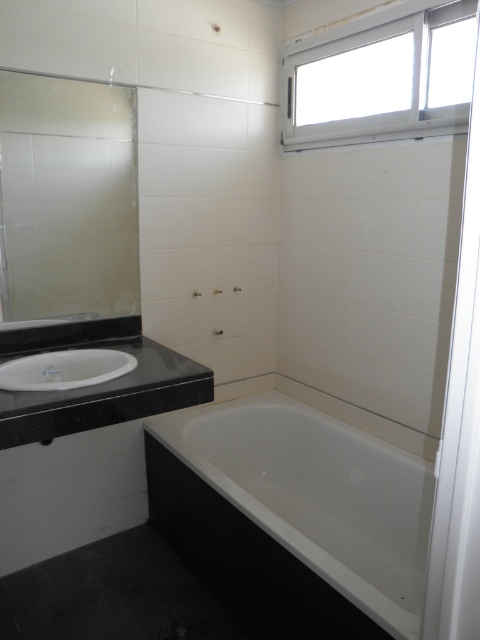
Question: Is the position of white glossy bathtub at lower center less distant than that of white plastic window at upper right?

Choices:
 (A) yes
 (B) no

Answer: (A)

Question: Estimate the real-world distances between objects in this image. Which object is farther from the white glossy bathtub at lower center?

Choices:
 (A) matte glass mirror at left
 (B) white plastic window at upper right
 (C) white glossy sink at lower left

Answer: (B)

Question: Based on their relative distances, which object is nearer to the white glossy sink at lower left?

Choices:
 (A) matte glass mirror at left
 (B) white glossy bathtub at lower center

Answer: (A)

Question: Can you confirm if white plastic window at upper right is smaller than white glossy sink at lower left?

Choices:
 (A) yes
 (B) no

Answer: (B)

Question: Does white plastic window at upper right have a larger size compared to white glossy sink at lower left?

Choices:
 (A) no
 (B) yes

Answer: (B)

Question: Based on their relative distances, which object is nearer to the white glossy bathtub at lower center?

Choices:
 (A) matte glass mirror at left
 (B) white glossy sink at lower left

Answer: (B)